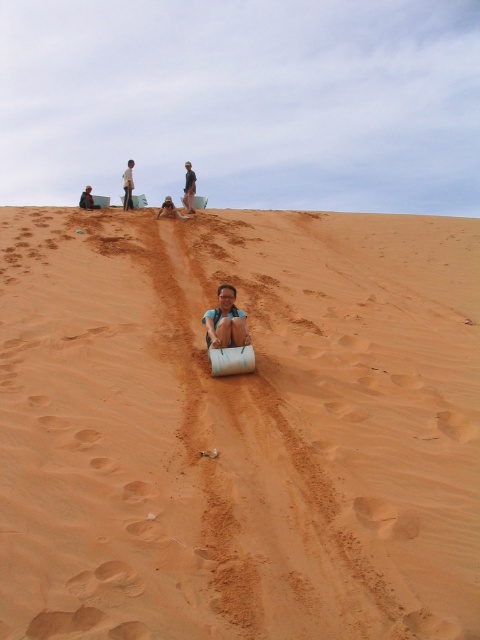
Consider the image. Which is more to the right, green fabric shirt at center or light brown sand at upper center?

green fabric shirt at center

Find the location of a particular element. The width and height of the screenshot is (480, 640). green fabric shirt at center is located at coordinates (189, 188).

Where is `green fabric shirt at center`? This screenshot has height=640, width=480. green fabric shirt at center is located at coordinates (189, 188).

Is point (184, 177) farther from camera compared to point (87, 204)?

Yes, point (184, 177) is farther from viewer.

Does point (189, 200) come closer to viewer compared to point (84, 200)?

Yes, it is.

Is point (190, 163) positioned behind point (86, 209)?

That is True.

The width and height of the screenshot is (480, 640). I want to click on green fabric shirt at center, so click(x=189, y=188).

Who is lower down, matte brown sand at center or dark blue fabric at lower left?

matte brown sand at center

Between point (239, 324) and point (82, 193), which one is positioned in front?

Point (239, 324)

You are a GUI agent. You are given a task and a screenshot of the screen. Output one action in this format:
    pyautogui.click(x=<x>, y=<y>)
    Task: Click on the matte brown sand at center
    
    Given the screenshot: What is the action you would take?
    pyautogui.click(x=226, y=321)